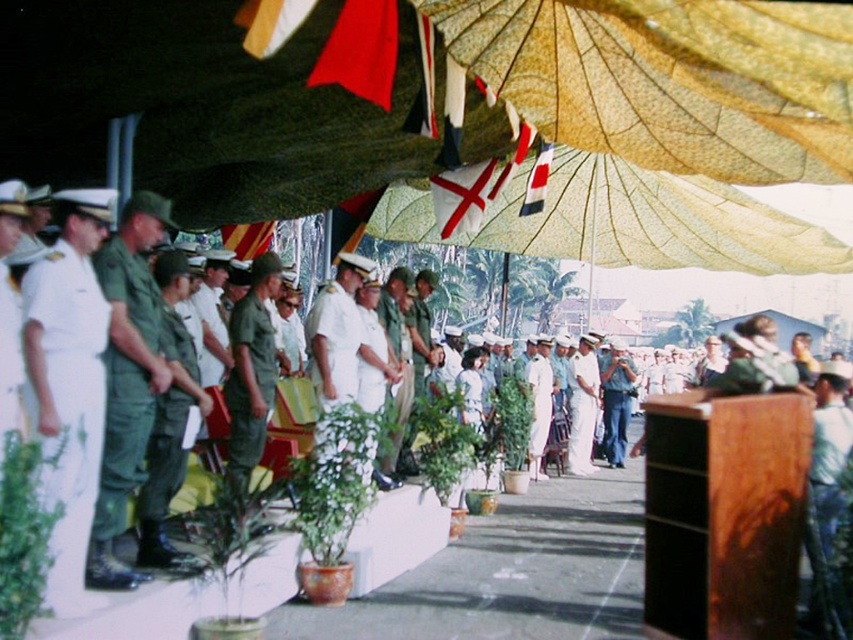
You are a photographer positioned at point (173, 428). You need to capture a group photo of the attendees. Considering the distance between you and the group, will you be able to clearly capture their facial features without using a zoom lens?

The distance between you and the group is 8.66 meters. Without a zoom lens, capturing clear facial features at this distance may be challenging due to the limited focal length of standard lenses. It is recommended to use a zoom lens for better clarity.

Based on the photo, you are a photographer positioned at the camera location. You want to capture a closeup shot of the green fabric uniform at left. Given that your camera has a minimum focusing distance of 5 meters, can you successfully take the photo without moving closer?

The green fabric uniform at left is 8.41 meters away from camera, which is beyond the minimum focusing distance of 5 meters. Therefore, you can successfully take the closeup shot without moving closer.

You are a photographer at the event and want to capture a photo of the green matte uniform at left. You see a point marked at coordinates point [126,378]. Is this point located on the green matte uniform at left?

Yes, the point [126,378] is located on the green matte uniform at left.